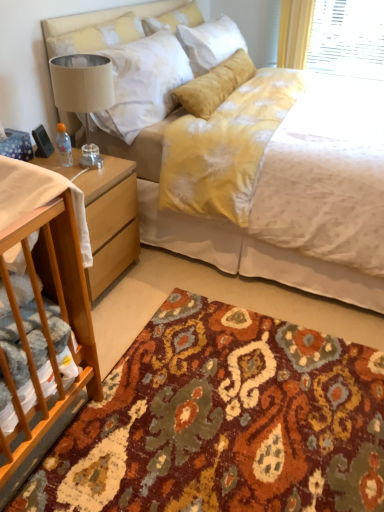
This screenshot has width=384, height=512. I want to click on white fabric at left, so click(38, 196).

Identify the location of light brown wood nightstand at lower left. The width and height of the screenshot is (384, 512). (110, 221).

Image resolution: width=384 pixels, height=512 pixels. I want to click on beige fabric lampshade at left, so click(82, 82).

Where is `soft yellow pillow at upper center`? This screenshot has height=512, width=384. soft yellow pillow at upper center is located at coordinates (174, 19).

The height and width of the screenshot is (512, 384). Identify the location of multicolored woven rug at lower center. (224, 421).

Relative to light brown wood nightstand at lower left, is white fabric at left in front or behind?

Visually, white fabric at left is located in front of light brown wood nightstand at lower left.

Considering the sizes of objects white fabric at left and light brown wood nightstand at lower left in the image provided, who is wider, white fabric at left or light brown wood nightstand at lower left?

Wider between the two is light brown wood nightstand at lower left.

From the image's perspective, is white fabric at left under light brown wood nightstand at lower left?

Yes.

Considering the relative positions of soft yellow pillow at upper center and yellow fabric bed at center in the image provided, is soft yellow pillow at upper center to the right of yellow fabric bed at center from the viewer's perspective?

In fact, soft yellow pillow at upper center is to the left of yellow fabric bed at center.

Can you confirm if soft yellow pillow at upper center is smaller than yellow fabric bed at center?

Yes.

Is yellow fabric bed at center inside soft yellow pillow at upper center?

No, yellow fabric bed at center is located outside of soft yellow pillow at upper center.

Can you see soft yellow pillow at upper center touching yellow fabric bed at center?

No, soft yellow pillow at upper center is not with yellow fabric bed at center.

Is point (116, 373) closer to camera compared to point (85, 55)?

Yes, it is.

Considering the sizes of objects multicolored woven rug at lower center and beige fabric lampshade at left in the image provided, who is shorter, multicolored woven rug at lower center or beige fabric lampshade at left?

multicolored woven rug at lower center.

Is multicolored woven rug at lower center positioned with its back to beige fabric lampshade at left?

No.

Is multicolored woven rug at lower center outside of beige fabric lampshade at left?

multicolored woven rug at lower center lies outside beige fabric lampshade at left's area.

Would you say white fabric at left is a long distance from multicolored woven rug at lower center?

They are positioned close to each other.

From a real-world perspective, does white fabric at left stand above multicolored woven rug at lower center?

Indeed, from a real-world perspective, white fabric at left stands above multicolored woven rug at lower center.

Considering their positions, is white fabric at left located in front of or behind multicolored woven rug at lower center?

Visually, white fabric at left is located in front of multicolored woven rug at lower center.

Could you tell me if white fabric at left is facing multicolored woven rug at lower center?

No, white fabric at left is not oriented towards multicolored woven rug at lower center.

From a real-world perspective, does yellow fabric bed at center sit lower than light brown wood nightstand at lower left?

Incorrect, from a real-world perspective, yellow fabric bed at center is higher than light brown wood nightstand at lower left.

Is the depth of yellow fabric bed at center less than that of light brown wood nightstand at lower left?

That is True.

Looking at this image, from their relative heights in the image, would you say yellow fabric bed at center is taller or shorter than light brown wood nightstand at lower left?

In the image, yellow fabric bed at center appears to be taller than light brown wood nightstand at lower left.

The width and height of the screenshot is (384, 512). I want to click on nightstand below the yellow fabric bed at center (from a real-world perspective), so click(x=110, y=221).

Choose the correct answer: Is white fabric at left inside soft yellow pillow at upper center or outside it?

white fabric at left exists outside the volume of soft yellow pillow at upper center.

From the image's perspective, is white fabric at left beneath soft yellow pillow at upper center?

Yes, from the image's perspective, white fabric at left is beneath soft yellow pillow at upper center.

This screenshot has width=384, height=512. Find the location of `sheet on the left of the soft yellow pillow at upper center`. sheet on the left of the soft yellow pillow at upper center is located at coordinates (38, 196).

Can you tell me how much white fabric at left and soft yellow pillow at upper center differ in facing direction?

white fabric at left and soft yellow pillow at upper center are facing 87 degrees away from each other.

From a real-world perspective, is yellow fabric bed at center positioned under beige fabric lampshade at left based on gravity?

Yes, from a real-world perspective, yellow fabric bed at center is beneath beige fabric lampshade at left.

From the image's perspective, which object appears higher, yellow fabric bed at center or beige fabric lampshade at left?

yellow fabric bed at center appears higher in the image.

How distant is yellow fabric bed at center from beige fabric lampshade at left?

The distance of yellow fabric bed at center from beige fabric lampshade at left is 23.40 inches.

Can you confirm if yellow fabric bed at center is wider than beige fabric lampshade at left?

Yes, yellow fabric bed at center is wider than beige fabric lampshade at left.

At what (x,y) coordinates should I click in order to perform the action: click on nightstand on the left side of white fabric at left. Please return your answer as a coordinate pair (x, y). This screenshot has width=384, height=512. Looking at the image, I should click on (110, 221).

Where is `pillow lying above the yellow fabric bed at center (from the image's perspective)`? The width and height of the screenshot is (384, 512). pillow lying above the yellow fabric bed at center (from the image's perspective) is located at coordinates (174, 19).

Looking at this image, estimate the real-world distances between objects in this image. Which object is further from soft yellow pillow at upper center, multicolored woven rug at lower center or beige fabric lampshade at left?

multicolored woven rug at lower center.

When comparing their distances from soft yellow pillow at upper center, does multicolored woven rug at lower center or light brown wood nightstand at lower left seem closer?

The object closer to soft yellow pillow at upper center is light brown wood nightstand at lower left.

From the picture: Estimate the real-world distances between objects in this image. Which object is closer to multicolored woven rug at lower center, white fabric at left or beige fabric lampshade at left?

white fabric at left lies closer to multicolored woven rug at lower center than the other object.

Considering their positions, is white fabric at left positioned further to soft yellow pillow at upper center than beige fabric lampshade at left?

white fabric at left lies further to soft yellow pillow at upper center than the other object.

Estimate the real-world distances between objects in this image. Which object is further from multicolored woven rug at lower center, soft yellow pillow at upper center or beige fabric lampshade at left?

Based on the image, soft yellow pillow at upper center appears to be further to multicolored woven rug at lower center.

From the image, which object appears to be nearer to white fabric at left, yellow fabric bed at center or beige fabric lampshade at left?

beige fabric lampshade at left lies closer to white fabric at left than the other object.

Considering their positions, is white fabric at left positioned further to light brown wood nightstand at lower left than soft yellow pillow at upper center?

Based on the image, soft yellow pillow at upper center appears to be further to light brown wood nightstand at lower left.

When comparing their distances from beige fabric lampshade at left, does multicolored woven rug at lower center or white fabric at left seem closer?

The object closer to beige fabric lampshade at left is white fabric at left.

The width and height of the screenshot is (384, 512). Identify the location of lamp between white fabric at left and light brown wood nightstand at lower left in the front-back direction. (82, 82).

Where is `lamp between soft yellow pillow at upper center and multicolored woven rug at lower center vertically`? This screenshot has height=512, width=384. lamp between soft yellow pillow at upper center and multicolored woven rug at lower center vertically is located at coordinates (82, 82).

Image resolution: width=384 pixels, height=512 pixels. What are the coordinates of `bed that lies between soft yellow pillow at upper center and light brown wood nightstand at lower left from top to bottom` in the screenshot? It's located at (232, 234).

The image size is (384, 512). In order to click on lamp between white fabric at left and soft yellow pillow at upper center in the front-back direction in this screenshot , I will do `click(82, 82)`.